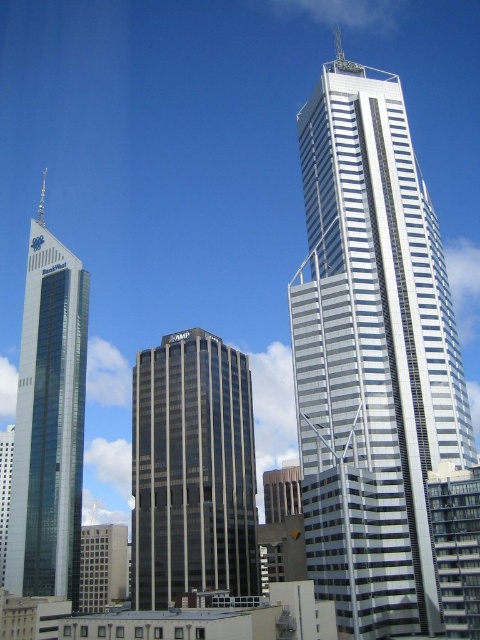
Question: Does dark gray glass building at center have a lesser width compared to glassy reflective skyscraper at left?

Choices:
 (A) no
 (B) yes

Answer: (B)

Question: Where is dark gray glass building at center located in relation to glassy reflective skyscraper at left in the image?

Choices:
 (A) below
 (B) above

Answer: (A)

Question: Can you confirm if white glass skyscraper at upper right is positioned below glassy reflective skyscraper at left?

Choices:
 (A) no
 (B) yes

Answer: (A)

Question: Which point is closer to the camera?

Choices:
 (A) [48, 541]
 (B) [359, 316]
 (C) [155, 609]

Answer: (B)

Question: Estimate the real-world distances between objects in this image. Which object is farther from the white glass skyscraper at upper right?

Choices:
 (A) glassy reflective skyscraper at left
 (B) dark gray glass building at center

Answer: (A)

Question: Among these objects, which one is nearest to the camera?

Choices:
 (A) glassy reflective skyscraper at left
 (B) white glass skyscraper at upper right

Answer: (B)